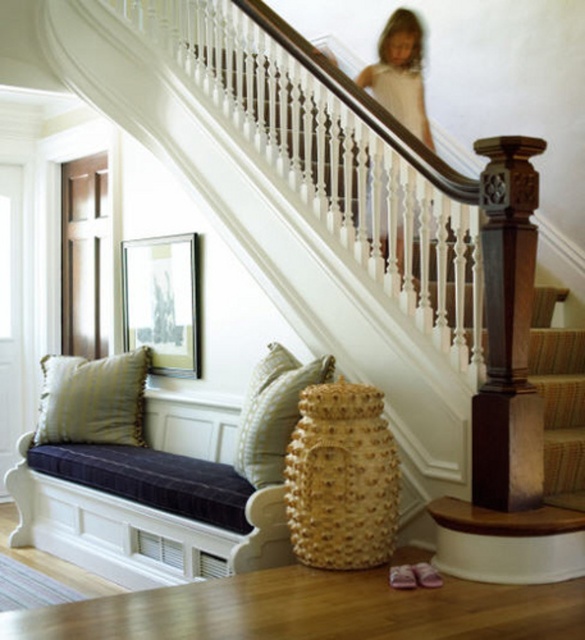
Image resolution: width=585 pixels, height=640 pixels. Find the location of `dark wood post at center`. dark wood post at center is located at coordinates (507, 332).

Does dark wood post at center have a lesser height compared to white lace dress at upper center?

No, dark wood post at center is not shorter than white lace dress at upper center.

Is point (483, 275) more distant than point (391, 70)?

No, (483, 275) is closer to viewer.

Locate an element on the screen. This screenshot has width=585, height=640. dark wood post at center is located at coordinates (507, 332).

Can you confirm if velvet blue bench at lower left is positioned to the right of dark wood post at center?

No, velvet blue bench at lower left is not to the right of dark wood post at center.

Between point (70, 481) and point (512, 200), which one is positioned in front?

Point (512, 200) is in front.

The width and height of the screenshot is (585, 640). I want to click on velvet blue bench at lower left, so click(139, 531).

Does green striped pillow at left have a lesser height compared to textured beige pillow at center?

Yes.

Image resolution: width=585 pixels, height=640 pixels. I want to click on green striped pillow at left, so click(92, 400).